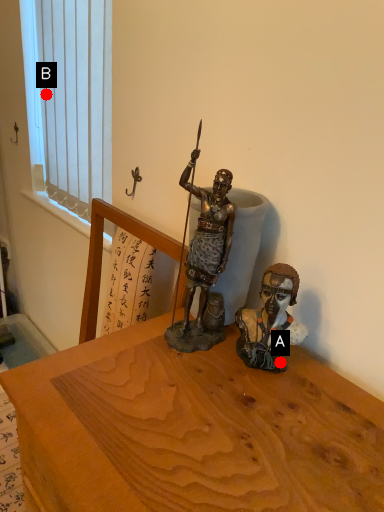
Question: Two points are circled on the image, labeled by A and B beside each circle. Which point is farther to the camera?

Choices:
 (A) A is further
 (B) B is further

Answer: (B)